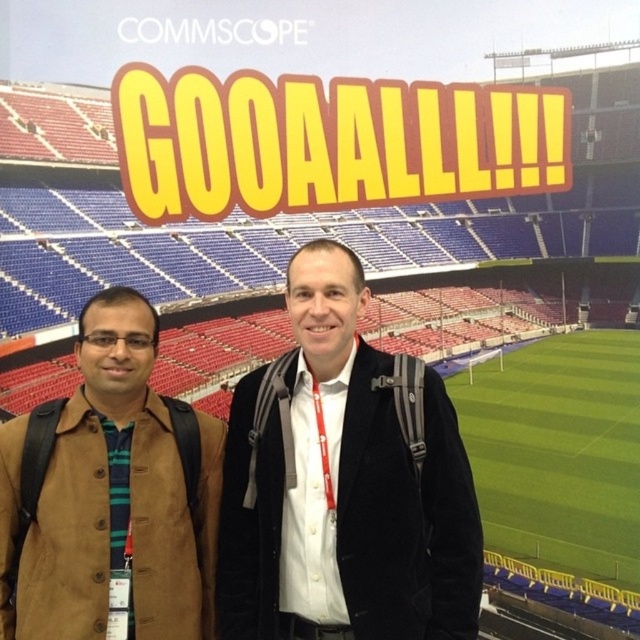
Question: Among these points, which one is farthest from the camera?

Choices:
 (A) (211, 557)
 (B) (452, 442)

Answer: (A)

Question: Does black velvet jacket at center appear on the left side of brown suede jacket at left?

Choices:
 (A) no
 (B) yes

Answer: (A)

Question: Can you confirm if black velvet jacket at center is positioned above brown suede jacket at left?

Choices:
 (A) no
 (B) yes

Answer: (B)

Question: Which point is farther to the camera?

Choices:
 (A) black velvet jacket at center
 (B) brown suede jacket at left

Answer: (A)

Question: Can you confirm if black velvet jacket at center is positioned to the left of brown suede jacket at left?

Choices:
 (A) no
 (B) yes

Answer: (A)